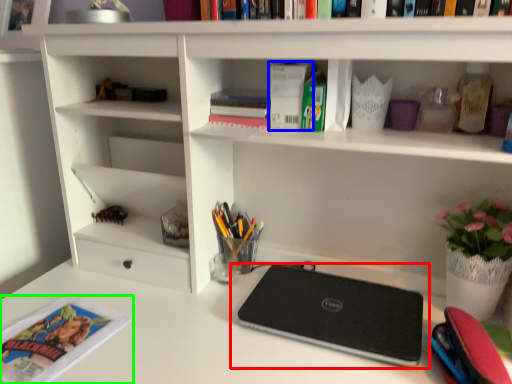
Question: Which object is positioned farthest from laptop (highlighted by a red box)? Select from paperback book (highlighted by a blue box) and magazine (highlighted by a green box).

Choices:
 (A) paperback book
 (B) magazine

Answer: (B)